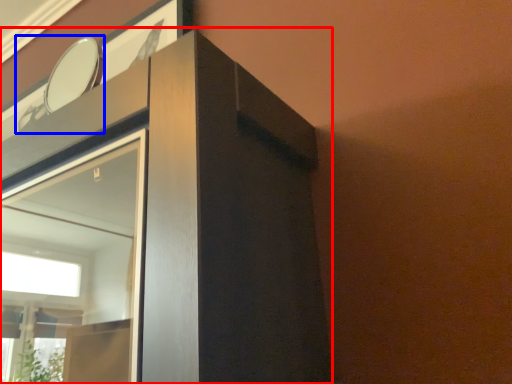
Question: Which of the following is the closest to the observer, dresser (highlighted by a red box) or mirror (highlighted by a blue box)?

Choices:
 (A) dresser
 (B) mirror

Answer: (A)